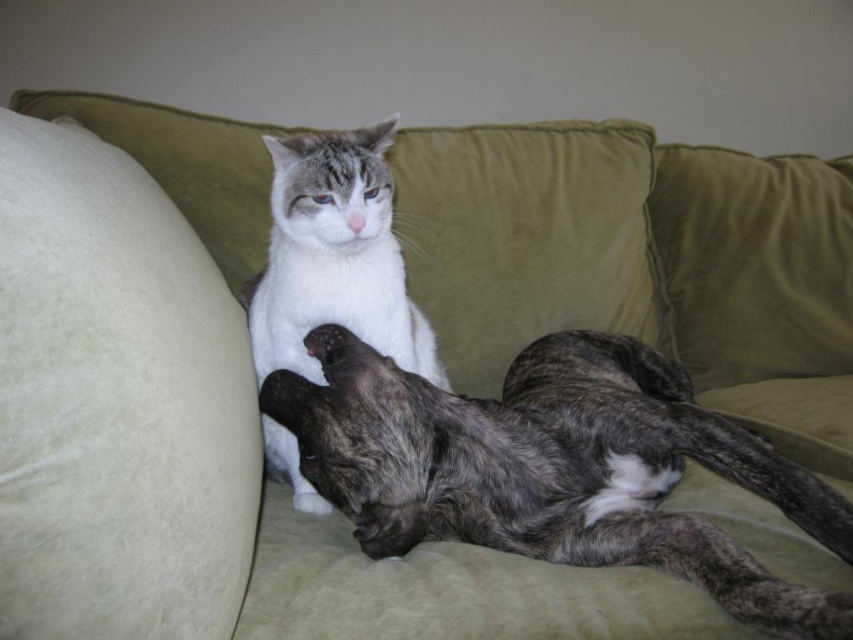
Question: Can you confirm if white soft cushion at left is positioned below speckled fur dog at center?

Choices:
 (A) no
 (B) yes

Answer: (A)

Question: Does white soft cushion at left appear over white soft fur cat at center?

Choices:
 (A) yes
 (B) no

Answer: (B)

Question: Estimate the real-world distances between objects in this image. Which object is farther from the speckled fur dog at center?

Choices:
 (A) white soft fur cat at center
 (B) white soft cushion at left
 (C) dark gray fur paw at center

Answer: (B)

Question: Estimate the real-world distances between objects in this image. Which object is farther from the white soft cushion at left?

Choices:
 (A) speckled fur dog at center
 (B) dark gray fur paw at center

Answer: (A)

Question: Can you confirm if white soft fur cat at center is positioned below dark gray fur paw at center?

Choices:
 (A) yes
 (B) no

Answer: (B)

Question: Which object appears farthest from the camera in this image?

Choices:
 (A) dark gray fur paw at center
 (B) white soft fur cat at center

Answer: (A)